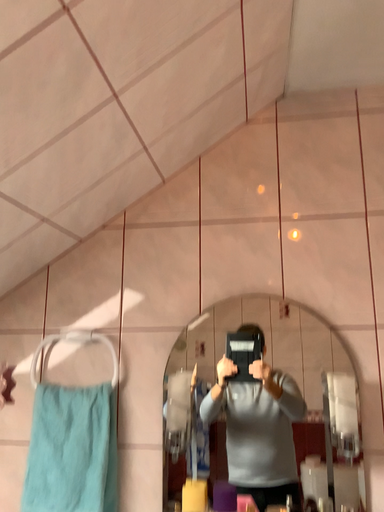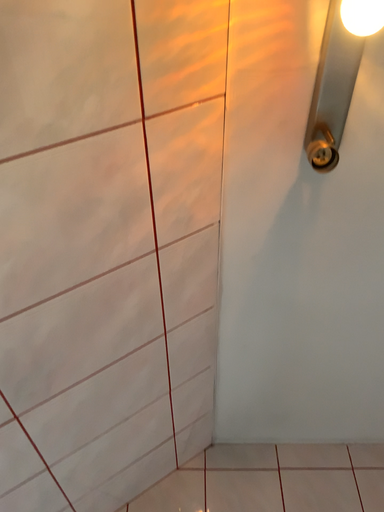
Question: How did the camera likely rotate when shooting the video?

Choices:
 (A) rotated left
 (B) rotated right

Answer: (B)